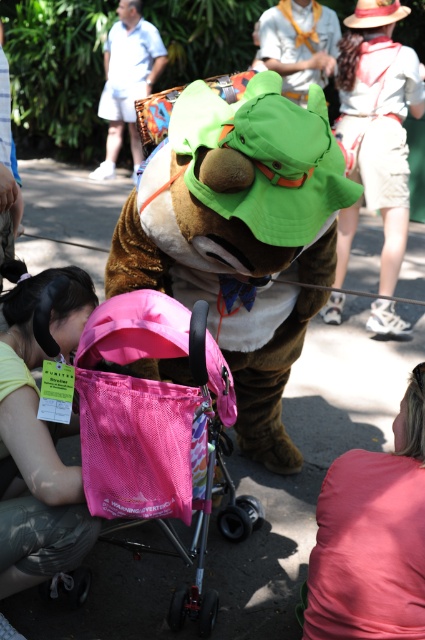
In the scene shown: Is brown furry mascot at center thinner than brown furry costume at upper center?

No, brown furry mascot at center is not thinner than brown furry costume at upper center.

Can you confirm if brown furry mascot at center is positioned to the left of brown furry costume at upper center?

Incorrect, brown furry mascot at center is not on the left side of brown furry costume at upper center.

Measure the distance between brown furry mascot at center and camera.

A distance of 2.50 meters exists between brown furry mascot at center and camera.

Find the location of a particular element. brown furry mascot at center is located at coordinates (240, 234).

Can you confirm if brown furry mascot at center is positioned to the right of green fabric hat at upper center?

In fact, brown furry mascot at center is to the left of green fabric hat at upper center.

Between brown furry mascot at center and green fabric hat at upper center, which one appears on the right side from the viewer's perspective?

green fabric hat at upper center

Does point (161, 284) lie behind point (289, 48)?

No, (161, 284) is in front of (289, 48).

Find the location of `brown furry mascot at center`. brown furry mascot at center is located at coordinates (240, 234).

Does pink mesh stroller at center appear on the left side of green fabric hat at upper center?

Yes, pink mesh stroller at center is to the left of green fabric hat at upper center.

Between point (150, 353) and point (271, 8), which one is positioned behind?

Point (271, 8)

Describe the element at coordinates (156, 429) in the screenshot. I see `pink mesh stroller at center` at that location.

The width and height of the screenshot is (425, 640). I want to click on pink mesh stroller at center, so click(x=156, y=429).